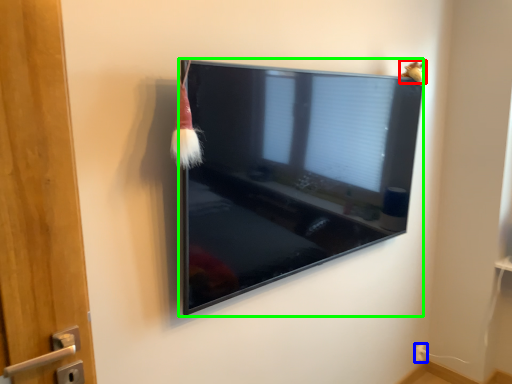
Question: Estimate the real-world distances between objects in this image. Which object is closer to animal (highlighted by a red box), electric outlet (highlighted by a blue box) or television (highlighted by a green box)?

Choices:
 (A) electric outlet
 (B) television

Answer: (B)